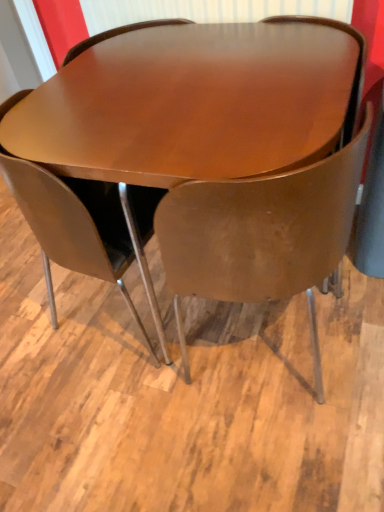
You are a GUI agent. You are given a task and a screenshot of the screen. Output one action in this format:
    pyautogui.click(x=<x>, y=<y>)
    Task: Click on the glossy wood table at center
    This screenshot has height=512, width=384.
    Given the screenshot: What is the action you would take?
    pyautogui.click(x=216, y=144)

What do you see at coordinates (216, 144) in the screenshot? I see `glossy wood table at center` at bounding box center [216, 144].

The height and width of the screenshot is (512, 384). I want to click on glossy wood table at center, so click(216, 144).

Where is `chair that appears above the matte brown chair at center, the first chair in the right-to-left sequence (from a real-world perspective)`? This screenshot has width=384, height=512. chair that appears above the matte brown chair at center, the first chair in the right-to-left sequence (from a real-world perspective) is located at coordinates (73, 225).

Considering the positions of objects matte brown chair at center, positioned as the 2th chair in right-to-left order, and matte brown chair at center, the first chair in the right-to-left sequence, in the image provided, who is more to the left, matte brown chair at center, positioned as the 2th chair in right-to-left order, or matte brown chair at center, the first chair in the right-to-left sequence,?

matte brown chair at center, positioned as the 2th chair in right-to-left order, is more to the left.

Is matte brown chair at center, acting as the first chair starting from the left, facing towards matte brown chair at center, which ranks as the second chair in left-to-right order?

No, matte brown chair at center, acting as the first chair starting from the left, is not oriented towards matte brown chair at center, which ranks as the second chair in left-to-right order.

In terms of height, does matte brown chair at center, acting as the first chair starting from the left, look taller or shorter compared to matte brown chair at center, which ranks as the second chair in left-to-right order?

matte brown chair at center, acting as the first chair starting from the left, is shorter than matte brown chair at center, which ranks as the second chair in left-to-right order.

Locate an element on the screen. table below the matte brown chair at center, positioned as the 2th chair in right-to-left order (from a real-world perspective) is located at coordinates click(x=216, y=144).

Can you confirm if matte brown chair at center, positioned as the 2th chair in right-to-left order, is positioned to the right of glossy wood table at center?

No.

Between matte brown chair at center, acting as the first chair starting from the left, and glossy wood table at center, which one has larger size?

glossy wood table at center.

In the scene shown: Considering their positions, is matte brown chair at center, positioned as the 2th chair in right-to-left order, located in front of or behind glossy wood table at center?

Visually, matte brown chair at center, positioned as the 2th chair in right-to-left order, is located behind glossy wood table at center.

Is matte brown chair at center, the first chair in the right-to-left sequence, not near matte brown chair at center, positioned as the 2th chair in right-to-left order?

They are positioned close to each other.

Locate an element on the screen. The image size is (384, 512). chair that appears in front of the matte brown chair at center, acting as the first chair starting from the left is located at coordinates (261, 234).

Could you measure the distance between matte brown chair at center, which ranks as the second chair in left-to-right order, and matte brown chair at center, positioned as the 2th chair in right-to-left order?

A distance of 12.61 inches exists between matte brown chair at center, which ranks as the second chair in left-to-right order, and matte brown chair at center, positioned as the 2th chair in right-to-left order.

Based on the photo, which object is wider, matte brown chair at center, which ranks as the second chair in left-to-right order, or matte brown chair at center, positioned as the 2th chair in right-to-left order?

matte brown chair at center, which ranks as the second chair in left-to-right order.

From the picture: Between glossy wood table at center and matte brown chair at center, acting as the first chair starting from the left, which one has less height?

With less height is glossy wood table at center.

Considering the relative sizes of glossy wood table at center and matte brown chair at center, acting as the first chair starting from the left, in the image provided, is glossy wood table at center wider than matte brown chair at center, acting as the first chair starting from the left,?

Indeed, glossy wood table at center has a greater width compared to matte brown chair at center, acting as the first chair starting from the left.

Which is more distant, (337, 229) or (31, 172)?

Positioned behind is point (337, 229).

Is glossy wood table at center thinner than matte brown chair at center, the first chair in the right-to-left sequence?

No.

Considering the points (164, 64) and (255, 237), which point is in front, point (164, 64) or point (255, 237)?

Point (255, 237)

Can you confirm if glossy wood table at center is positioned to the right of matte brown chair at center, the first chair in the right-to-left sequence?

In fact, glossy wood table at center is to the left of matte brown chair at center, the first chair in the right-to-left sequence.

Based on the photo, how different are the orientations of glossy wood table at center and matte brown chair at center, the first chair in the right-to-left sequence, in degrees?

The angle between the facing direction of glossy wood table at center and the facing direction of matte brown chair at center, the first chair in the right-to-left sequence, is 180 degrees.

Is glossy wood table at center surrounded by matte brown chair at center, which ranks as the second chair in left-to-right order?

Definitely not — glossy wood table at center is not inside matte brown chair at center, which ranks as the second chair in left-to-right order.

How different are the orientations of matte brown chair at center, the first chair in the right-to-left sequence, and glossy wood table at center in degrees?

There is a 180-degree angle between the facing directions of matte brown chair at center, the first chair in the right-to-left sequence, and glossy wood table at center.

Is matte brown chair at center, the first chair in the right-to-left sequence, to the left or to the right of glossy wood table at center in the image?

Clearly, matte brown chair at center, the first chair in the right-to-left sequence, is on the right of glossy wood table at center in the image.

Considering the sizes of objects matte brown chair at center, the first chair in the right-to-left sequence, and glossy wood table at center in the image provided, who is wider, matte brown chair at center, the first chair in the right-to-left sequence, or glossy wood table at center?

Wider between the two is glossy wood table at center.

Locate an element on the screen. chair below the matte brown chair at center, acting as the first chair starting from the left (from the image's perspective) is located at coordinates (261, 234).

The height and width of the screenshot is (512, 384). I want to click on table on the right of matte brown chair at center, positioned as the 2th chair in right-to-left order, so [x=216, y=144].

From the image, which object appears to be nearer to matte brown chair at center, which ranks as the second chair in left-to-right order, glossy wood table at center or matte brown chair at center, positioned as the 2th chair in right-to-left order?

The object closer to matte brown chair at center, which ranks as the second chair in left-to-right order, is glossy wood table at center.

When comparing their distances from matte brown chair at center, acting as the first chair starting from the left, does matte brown chair at center, the first chair in the right-to-left sequence, or glossy wood table at center seem further?

Based on the image, matte brown chair at center, the first chair in the right-to-left sequence, appears to be further to matte brown chair at center, acting as the first chair starting from the left.

Estimate the real-world distances between objects in this image. Which object is further from glossy wood table at center, matte brown chair at center, acting as the first chair starting from the left, or matte brown chair at center, which ranks as the second chair in left-to-right order?

matte brown chair at center, acting as the first chair starting from the left, is further to glossy wood table at center.

Which object lies further to the anchor point matte brown chair at center, acting as the first chair starting from the left, glossy wood table at center or matte brown chair at center, which ranks as the second chair in left-to-right order?

matte brown chair at center, which ranks as the second chair in left-to-right order, is further to matte brown chair at center, acting as the first chair starting from the left.

Looking at the image, which one is located closer to glossy wood table at center, matte brown chair at center, the first chair in the right-to-left sequence, or matte brown chair at center, acting as the first chair starting from the left?

matte brown chair at center, the first chair in the right-to-left sequence, is closer to glossy wood table at center.

Which object lies further to the anchor point matte brown chair at center, the first chair in the right-to-left sequence, matte brown chair at center, acting as the first chair starting from the left, or glossy wood table at center?

The object further to matte brown chair at center, the first chair in the right-to-left sequence, is matte brown chair at center, acting as the first chair starting from the left.

At what (x,y) coordinates should I click in order to perform the action: click on table between matte brown chair at center, acting as the first chair starting from the left, and matte brown chair at center, which ranks as the second chair in left-to-right order, in the horizontal direction. Please return your answer as a coordinate pair (x, y). Looking at the image, I should click on (216, 144).